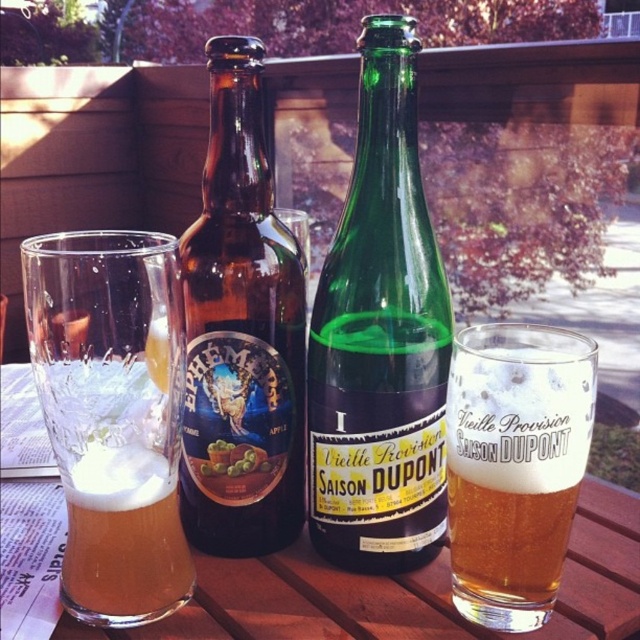
Question: Among these objects, which one is nearest to the camera?

Choices:
 (A) brown glass bottle at center
 (B) foamy glass at center

Answer: (B)

Question: Where is green glass bottle at center located in relation to brown glass bottle at center in the image?

Choices:
 (A) left
 (B) right

Answer: (B)

Question: Which object is positioned closest to the clear glass mug at left?

Choices:
 (A) brown wooden picnic table at center
 (B) foamy glass at center

Answer: (A)

Question: Which object appears closest to the camera in this image?

Choices:
 (A) brown glass bottle at center
 (B) clear glass mug at left
 (C) foamy glass at center
 (D) green glass bottle at center

Answer: (B)

Question: Is brown wooden picnic table at center above golden matte beer at center?

Choices:
 (A) yes
 (B) no

Answer: (B)

Question: In this image, where is green glass bottle at center located relative to clear glass mug at left?

Choices:
 (A) below
 (B) above

Answer: (B)